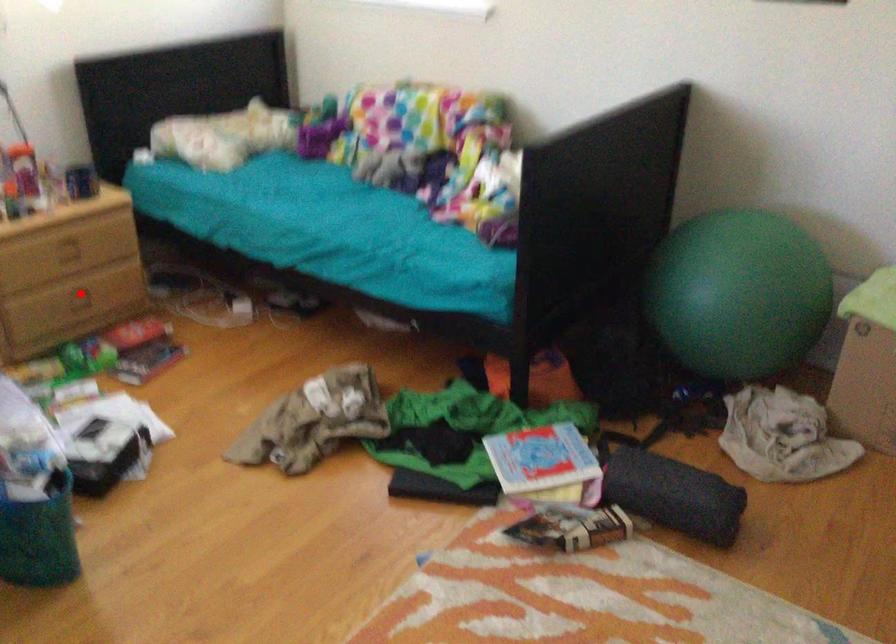
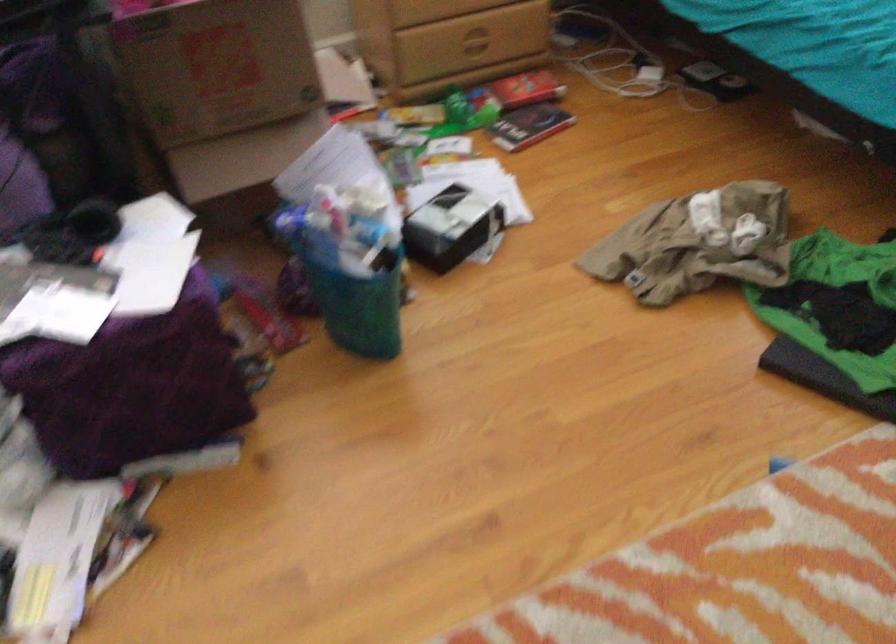
Where in the second image is the point corresponding to the highlighted location from the first image?

(472, 40)